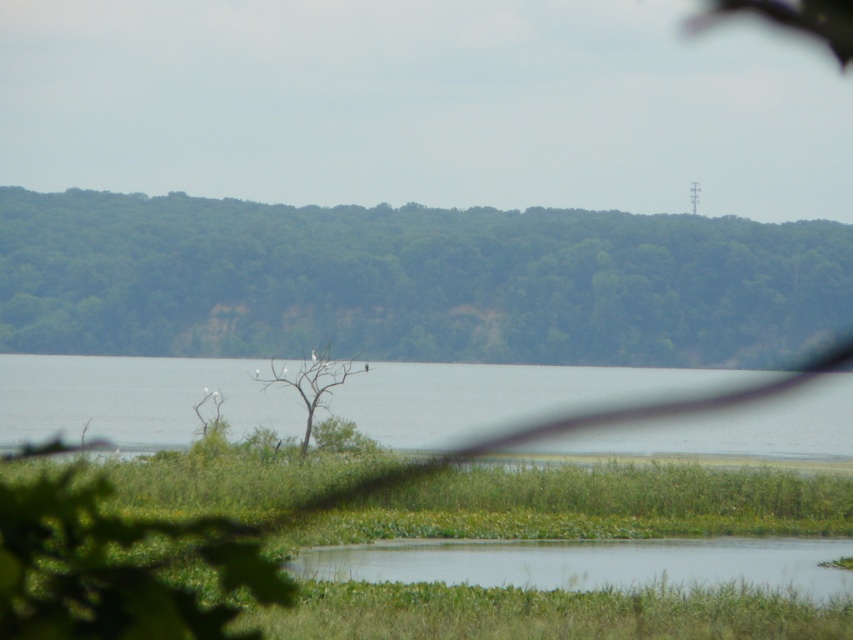
Does clear water at lower center lie in front of dead wood tree at center?

Yes, clear water at lower center is closer to the viewer.

Is point (817, 552) positioned after point (311, 394)?

No, (817, 552) is closer to viewer.

Between point (718, 577) and point (293, 385), which one is positioned in front?

Point (718, 577) is more forward.

Where is `clear water at lower center`? clear water at lower center is located at coordinates click(589, 563).

Can you confirm if clear water at center is positioned below clear water at lower center?

No.

Image resolution: width=853 pixels, height=640 pixels. Find the location of `clear water at center`. clear water at center is located at coordinates (135, 397).

Image resolution: width=853 pixels, height=640 pixels. What are the coordinates of `clear water at center` in the screenshot? It's located at (135, 397).

Between point (323, 304) and point (320, 369), which one is positioned in front?

Positioned in front is point (320, 369).

Is green leafy tree at upper center wider than dead wood tree at center?

Yes, green leafy tree at upper center is wider than dead wood tree at center.

Is point (492, 227) positioned after point (328, 348)?

Yes, point (492, 227) is farther from viewer.

Identify the location of green leafy tree at upper center. This screenshot has width=853, height=640. (413, 282).